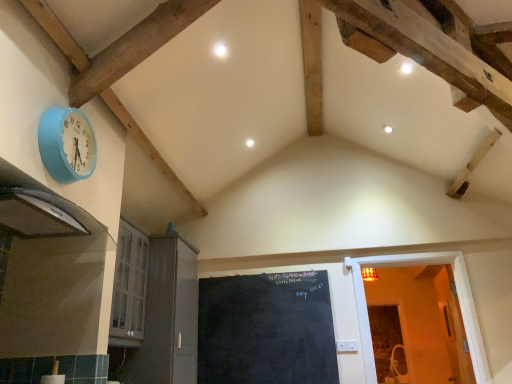
Question: Is wooden door at right, the second door viewed from the left, bigger than blue fabric wall clock at upper left?

Choices:
 (A) no
 (B) yes

Answer: (B)

Question: Is wooden door at right, the second door viewed from the left, shorter than blue fabric wall clock at upper left?

Choices:
 (A) yes
 (B) no

Answer: (B)

Question: Does wooden door at right, arranged as the first door when viewed from the right, appear on the left side of blue fabric wall clock at upper left?

Choices:
 (A) yes
 (B) no

Answer: (B)

Question: Is wooden door at right, the second door viewed from the left, not inside blue fabric wall clock at upper left?

Choices:
 (A) no
 (B) yes

Answer: (B)

Question: Can you confirm if wooden door at right, arranged as the first door when viewed from the right, is taller than blue fabric wall clock at upper left?

Choices:
 (A) yes
 (B) no

Answer: (A)

Question: Based on their positions, is blue fabric wall clock at upper left located to the left or right of black glossy exhaust hood at left?

Choices:
 (A) right
 (B) left

Answer: (A)

Question: Is point (89, 142) closer or farther from the camera than point (2, 173)?

Choices:
 (A) closer
 (B) farther

Answer: (B)

Question: From the image's perspective, is blue fabric wall clock at upper left positioned above or below black glossy exhaust hood at left?

Choices:
 (A) below
 (B) above

Answer: (B)

Question: Considering the positions of blue fabric wall clock at upper left and black glossy exhaust hood at left in the image, is blue fabric wall clock at upper left bigger or smaller than black glossy exhaust hood at left?

Choices:
 (A) big
 (B) small

Answer: (B)

Question: Based on their sizes in the image, would you say black glossy exhaust hood at left is bigger or smaller than white glossy cabinet at lower left, positioned as the first door in left-to-right order?

Choices:
 (A) small
 (B) big

Answer: (A)

Question: From a real-world perspective, is black glossy exhaust hood at left above or below white glossy cabinet at lower left, placed as the second door when sorted from right to left?

Choices:
 (A) below
 (B) above

Answer: (B)

Question: In the image, is black glossy exhaust hood at left positioned in front of or behind white glossy cabinet at lower left, positioned as the first door in left-to-right order?

Choices:
 (A) front
 (B) behind

Answer: (A)

Question: Visually, is black glossy exhaust hood at left positioned to the left or to the right of white glossy cabinet at lower left, positioned as the first door in left-to-right order?

Choices:
 (A) left
 (B) right

Answer: (A)

Question: Which is correct: blue fabric wall clock at upper left is inside white glossy cabinet at lower left, positioned as the first door in left-to-right order, or outside of it?

Choices:
 (A) outside
 (B) inside

Answer: (A)

Question: In terms of size, does blue fabric wall clock at upper left appear bigger or smaller than white glossy cabinet at lower left, placed as the second door when sorted from right to left?

Choices:
 (A) big
 (B) small

Answer: (B)